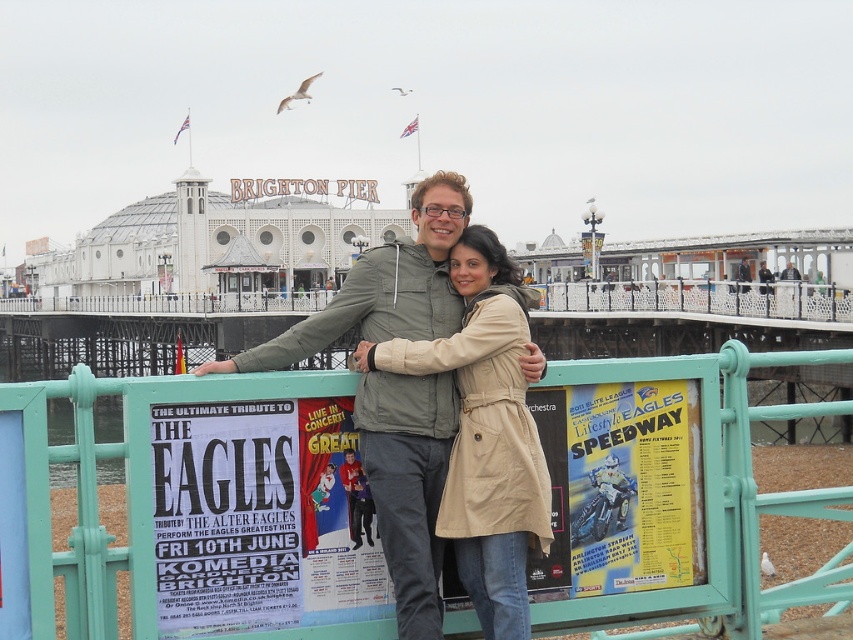
You are a tourist visiting Brighton Pier and see the teal metal fence at center and the yellow paper poster at lower right. Which object is closer to your right side when facing the scene?

The teal metal fence at center is positioned on the right side of the yellow paper poster at lower right, so when facing the scene, the teal metal fence at center would be closer to your right side.

You are a photographer at Brighton Pier. You want to take a photo of the white paper poster at center without including the teal metal fence at center in the background. Is this possible given their sizes?

The teal metal fence at center is much taller than the white paper poster at center, so it would be difficult to avoid capturing the fence in the background since it towers over the poster.